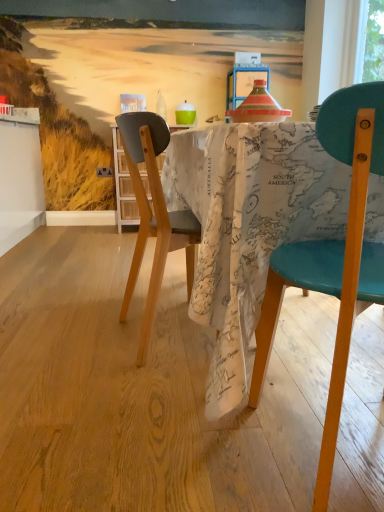
Question: Would you say wooden floor at center contains translucent glass bottle at center?

Choices:
 (A) no
 (B) yes

Answer: (A)

Question: Does wooden floor at center come in front of translucent glass bottle at center?

Choices:
 (A) yes
 (B) no

Answer: (A)

Question: Is wooden floor at center outside translucent glass bottle at center?

Choices:
 (A) yes
 (B) no

Answer: (A)

Question: Does wooden floor at center have a smaller size compared to translucent glass bottle at center?

Choices:
 (A) yes
 (B) no

Answer: (B)

Question: Can you confirm if wooden floor at center is shorter than translucent glass bottle at center?

Choices:
 (A) no
 (B) yes

Answer: (B)

Question: Based on their positions, is wooden floor at center located to the left or right of map-patterned fabric at center?

Choices:
 (A) left
 (B) right

Answer: (A)

Question: Choose the correct answer: Is wooden floor at center inside map-patterned fabric at center or outside it?

Choices:
 (A) outside
 (B) inside

Answer: (A)

Question: Considering their positions, is wooden floor at center located in front of or behind map-patterned fabric at center?

Choices:
 (A) behind
 (B) front

Answer: (B)

Question: Looking at their shapes, would you say wooden floor at center is wider or thinner than map-patterned fabric at center?

Choices:
 (A) thin
 (B) wide

Answer: (B)

Question: Considering the positions of wooden floor at center and translucent glass bottle at center in the image, is wooden floor at center taller or shorter than translucent glass bottle at center?

Choices:
 (A) tall
 (B) short

Answer: (B)

Question: From the image's perspective, relative to translucent glass bottle at center, is wooden floor at center above or below?

Choices:
 (A) below
 (B) above

Answer: (A)

Question: Looking at their shapes, would you say wooden floor at center is wider or thinner than translucent glass bottle at center?

Choices:
 (A) thin
 (B) wide

Answer: (B)

Question: Is wooden floor at center in front of or behind translucent glass bottle at center in the image?

Choices:
 (A) front
 (B) behind

Answer: (A)

Question: In terms of height, does map-patterned fabric at center look taller or shorter compared to wooden floor at center?

Choices:
 (A) short
 (B) tall

Answer: (B)

Question: Does point (246, 309) appear closer or farther from the camera than point (31, 309)?

Choices:
 (A) farther
 (B) closer

Answer: (B)